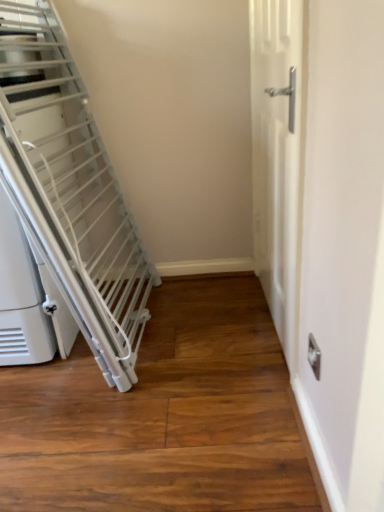
This screenshot has height=512, width=384. What do you see at coordinates (277, 157) in the screenshot? I see `white matte door at center` at bounding box center [277, 157].

Identify the location of white matte door at center. The height and width of the screenshot is (512, 384). (277, 157).

Find the location of a particular element. Image resolution: width=384 pixels, height=512 pixels. white matte door at center is located at coordinates (277, 157).